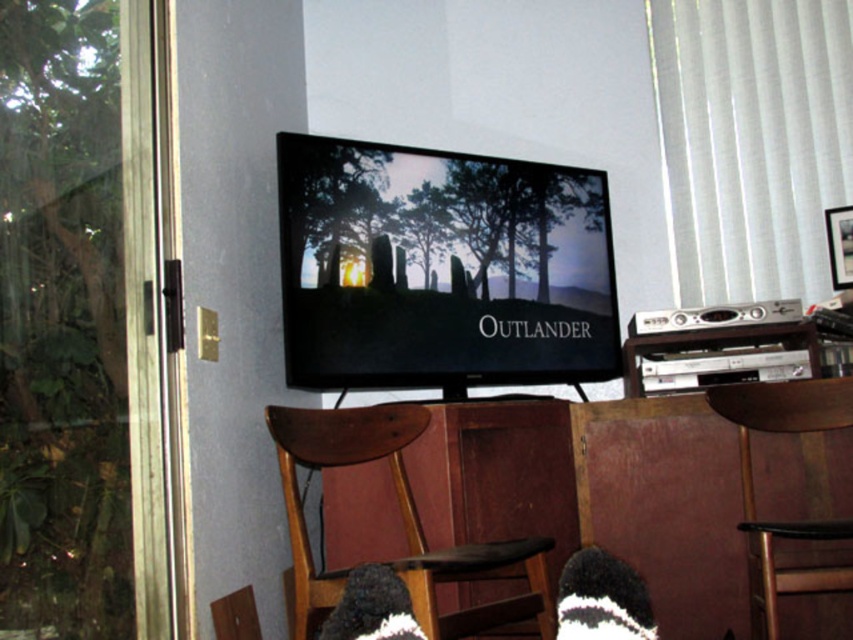
Question: Among these points, which one is nearest to the camera?

Choices:
 (A) (616, 305)
 (B) (326, 605)
 (C) (766, 330)
 (D) (175, 632)

Answer: (D)

Question: Which is farther from the black knitted sock at lower center?

Choices:
 (A) silver metallic dvd player at right
 (B) transparent glass door at left
 (C) clear glass screen door at left

Answer: (A)

Question: Is matte black tv at center bigger than silver metallic dvd player at right?

Choices:
 (A) no
 (B) yes

Answer: (B)

Question: Is transparent glass door at left behind brown wood chair at lower left?

Choices:
 (A) no
 (B) yes

Answer: (A)

Question: Does transparent glass door at left come in front of matte black tv at center?

Choices:
 (A) no
 (B) yes

Answer: (B)

Question: Among these objects, which one is farthest from the camera?

Choices:
 (A) brown wood armchair at lower center
 (B) clear glass screen door at left

Answer: (A)